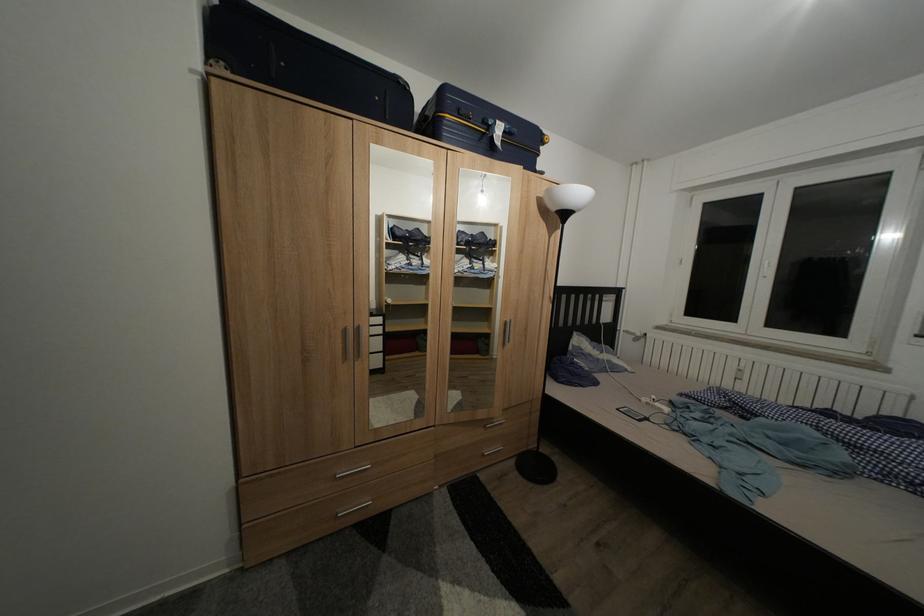
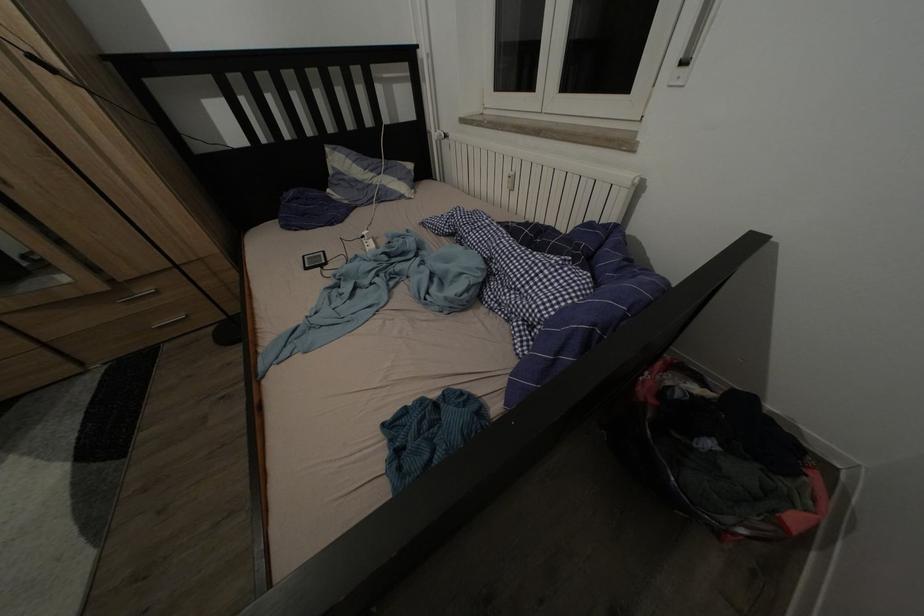
Locate, in the second image, the point that corresponds to point (661, 403) in the first image.

(372, 238)